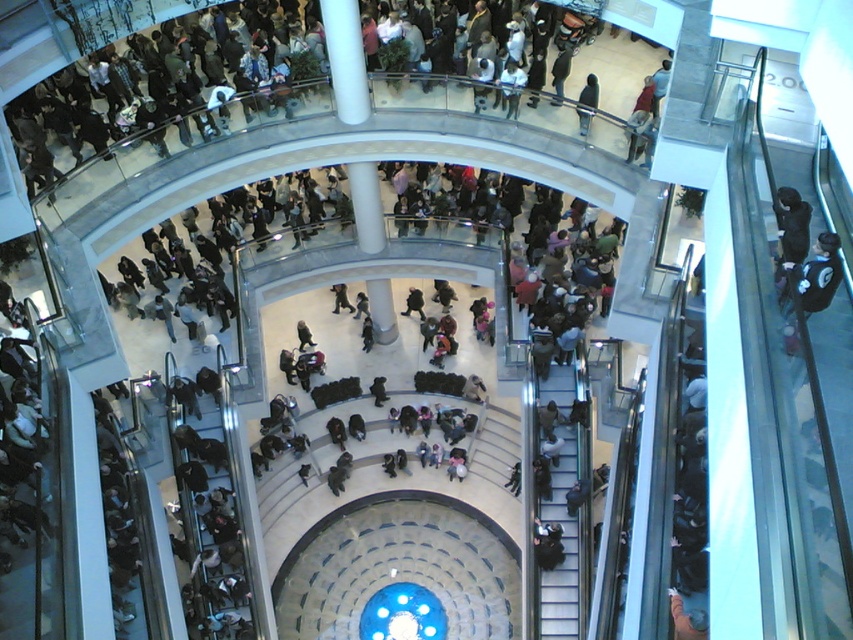
Who is lower down, metallic gray escalator at lower right or dark blue jacket at center?

metallic gray escalator at lower right is below.

Is point (577, 579) closer to viewer compared to point (589, 106)?

Yes.

Is point (576, 568) farther from camera compared to point (596, 90)?

No, it is in front of (596, 90).

Image resolution: width=853 pixels, height=640 pixels. Identify the location of metallic gray escalator at lower right. (564, 547).

Measure the distance from translucent glass dome at center to metallic gray escalator at lower right.

A distance of 6.04 meters exists between translucent glass dome at center and metallic gray escalator at lower right.

Does translucent glass dome at center appear under metallic gray escalator at lower right?

Yes, translucent glass dome at center is below metallic gray escalator at lower right.

Measure the distance between translucent glass dome at center and camera.

translucent glass dome at center is 32.23 meters from camera.

The image size is (853, 640). In order to click on translucent glass dome at center in this screenshot , I will do `click(399, 564)`.

Which of these two, translucent glass dome at center or dark blue jacket at center, stands taller?

With more height is dark blue jacket at center.

Who is shorter, translucent glass dome at center or dark blue jacket at center?

translucent glass dome at center

Is point (335, 600) in front of point (596, 84)?

No, (335, 600) is behind (596, 84).

The height and width of the screenshot is (640, 853). What are the coordinates of `translucent glass dome at center` in the screenshot? It's located at (399, 564).